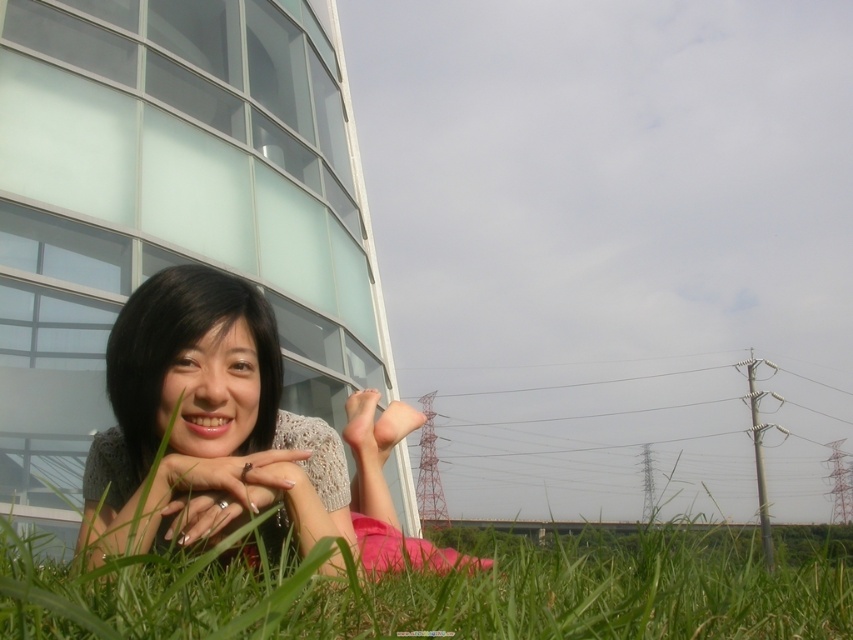
Question: Among these objects, which one is nearest to the camera?

Choices:
 (A) smooth skin girl at center
 (B) green grass at lower center
 (C) nail polish at center

Answer: (B)

Question: Does green grass at lower center appear under smooth skin girl at center?

Choices:
 (A) no
 (B) yes

Answer: (B)

Question: Is green grass at lower center above smooth skin girl at center?

Choices:
 (A) no
 (B) yes

Answer: (A)

Question: Based on their relative distances, which object is nearer to the smooth skin girl at center?

Choices:
 (A) green grass at lower center
 (B) nail polish at center

Answer: (B)

Question: Can you confirm if green grass at lower center is smaller than nail polish at center?

Choices:
 (A) no
 (B) yes

Answer: (A)

Question: Among these objects, which one is nearest to the camera?

Choices:
 (A) nail polish at center
 (B) smooth skin girl at center
 (C) green grass at lower center

Answer: (C)